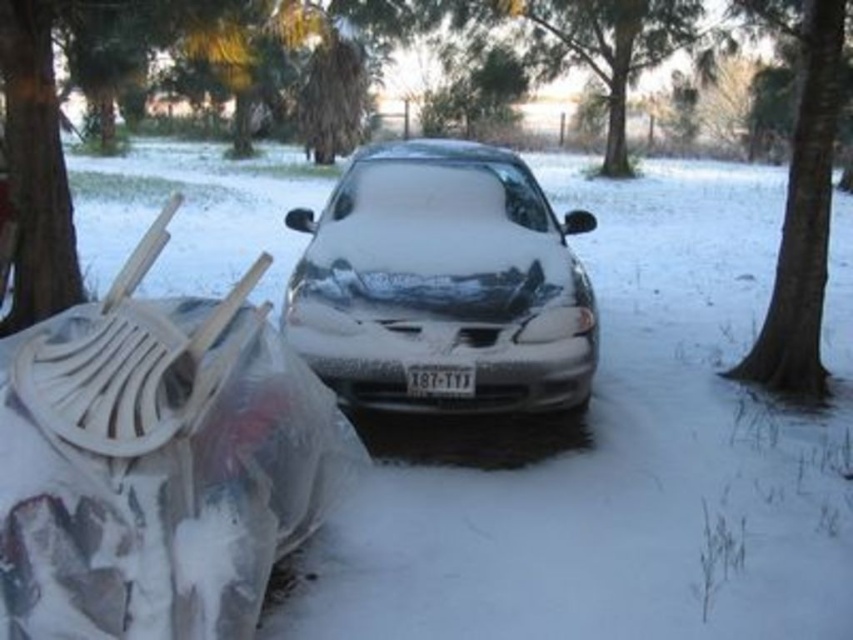
Is sleek metallic car at center further to camera compared to green leafy tree at upper center?

No, it is not.

Who is higher up, sleek metallic car at center or green leafy tree at upper center?

green leafy tree at upper center is higher up.

Between point (515, 333) and point (618, 84), which one is positioned in front?

Point (515, 333) is in front.

Where is `sleek metallic car at center`? The height and width of the screenshot is (640, 853). sleek metallic car at center is located at coordinates (442, 282).

From the picture: Does sleek metallic car at center have a greater height compared to smooth bark tree at center?

In fact, sleek metallic car at center may be shorter than smooth bark tree at center.

Is sleek metallic car at center behind smooth bark tree at center?

No, it is in front of smooth bark tree at center.

Locate an element on the screen. Image resolution: width=853 pixels, height=640 pixels. sleek metallic car at center is located at coordinates (442, 282).

Is smooth bark tree at center to the right of white plastic license plate at center from the viewer's perspective?

Indeed, smooth bark tree at center is positioned on the right side of white plastic license plate at center.

Who is shorter, smooth bark tree at center or white plastic license plate at center?

With less height is white plastic license plate at center.

You are a GUI agent. You are given a task and a screenshot of the screen. Output one action in this format:
    pyautogui.click(x=<x>, y=<y>)
    Task: Click on the smooth bark tree at center
    This screenshot has width=853, height=640.
    Given the screenshot: What is the action you would take?
    pyautogui.click(x=804, y=221)